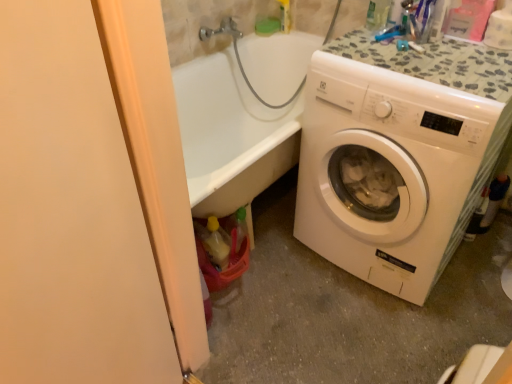
Locate an element on the screen. white plastic washing machine at right is located at coordinates (392, 171).

This screenshot has width=512, height=384. Describe the element at coordinates (392, 171) in the screenshot. I see `white plastic washing machine at right` at that location.

Measure the distance between point (422,304) and camera.

Point (422,304) is 5.37 feet from camera.

In order to face white plastic washing machine at right, should I rotate leftwards or rightwards?

Rotate your view right by about 18.151°.

What is the approximate width of white plastic washing machine at right?

It is 23.18 inches.

The width and height of the screenshot is (512, 384). Describe the element at coordinates (71, 213) in the screenshot. I see `matte peach screen door at left` at that location.

Where is `matte peach screen door at left`? The width and height of the screenshot is (512, 384). matte peach screen door at left is located at coordinates (71, 213).

At what (x,y) coordinates should I click in order to perform the action: click on white plastic washing machine at right. Please return your answer as a coordinate pair (x, y). Image resolution: width=512 pixels, height=384 pixels. Looking at the image, I should click on (392, 171).

Considering the relative positions of matte peach screen door at left and white plastic washing machine at right in the image provided, is matte peach screen door at left to the left of white plastic washing machine at right from the viewer's perspective?

Yes, matte peach screen door at left is to the left of white plastic washing machine at right.

Which object is closer to the camera taking this photo, matte peach screen door at left or white plastic washing machine at right?

matte peach screen door at left is more forward.

Considering the positions of points (42, 359) and (422, 209), is point (42, 359) closer to camera compared to point (422, 209)?

Yes, point (42, 359) is in front of point (422, 209).

From the image's perspective, which object appears higher, matte peach screen door at left or white plastic washing machine at right?

From the image's view, white plastic washing machine at right is above.

From a real-world perspective, is matte peach screen door at left located higher than white plastic washing machine at right?

Yes, from a real-world perspective, matte peach screen door at left is over white plastic washing machine at right

Can you confirm if matte peach screen door at left is wider than white plastic washing machine at right?

In fact, matte peach screen door at left might be narrower than white plastic washing machine at right.

Looking at this image, is matte peach screen door at left taller or shorter than white plastic washing machine at right?

matte peach screen door at left is taller than white plastic washing machine at right.

Considering the sizes of objects matte peach screen door at left and white plastic washing machine at right in the image provided, who is smaller, matte peach screen door at left or white plastic washing machine at right?

matte peach screen door at left is smaller.

Do you think matte peach screen door at left is within white plastic washing machine at right, or outside of it?

matte peach screen door at left exists outside the volume of white plastic washing machine at right.

Would you say matte peach screen door at left is a long distance from white plastic washing machine at right?

No, matte peach screen door at left is not far away from white plastic washing machine at right.

Is matte peach screen door at left facing towards white plastic washing machine at right?

No, matte peach screen door at left is not turned towards white plastic washing machine at right.

Can you tell me how much matte peach screen door at left and white plastic washing machine at right differ in facing direction?

The angle between the facing direction of matte peach screen door at left and the facing direction of white plastic washing machine at right is 112 degrees.

How distant is matte peach screen door at left from white plastic washing machine at right?

The distance of matte peach screen door at left from white plastic washing machine at right is 36.37 inches.

Where is `screen door in front of the white plastic washing machine at right`? Image resolution: width=512 pixels, height=384 pixels. screen door in front of the white plastic washing machine at right is located at coordinates click(71, 213).

Is white plastic washing machine at right at the right side of matte peach screen door at left?

Correct, you'll find white plastic washing machine at right to the right of matte peach screen door at left.

Consider the image. Is the depth of white plastic washing machine at right greater than that of matte peach screen door at left?

Yes, white plastic washing machine at right is further from the camera.

Which is less distant, [498,108] or [62,331]?

Point [498,108] appears to be farther away from the viewer than point [62,331].

From the image's perspective, is white plastic washing machine at right located beneath matte peach screen door at left?

No, from the image's perspective, white plastic washing machine at right is not below matte peach screen door at left.

From a real-world perspective, who is located higher, white plastic washing machine at right or matte peach screen door at left?

In real-world perspective, matte peach screen door at left is above.

In the scene shown: Which of these two, white plastic washing machine at right or matte peach screen door at left, is thinner?

Thinner between the two is matte peach screen door at left.

Considering the relative sizes of white plastic washing machine at right and matte peach screen door at left in the image provided, is white plastic washing machine at right taller than matte peach screen door at left?

No, white plastic washing machine at right is not taller than matte peach screen door at left.

Based on the photo, can you confirm if white plastic washing machine at right is smaller than matte peach screen door at left?

No, white plastic washing machine at right is not smaller than matte peach screen door at left.

Is white plastic washing machine at right not within matte peach screen door at left?

Yes, white plastic washing machine at right is not within matte peach screen door at left.

Is white plastic washing machine at right not near matte peach screen door at left?

white plastic washing machine at right is near matte peach screen door at left, not far away.

Is white plastic washing machine at right oriented towards matte peach screen door at left?

Yes.

In the scene shown: What's the angular difference between white plastic washing machine at right and matte peach screen door at left's facing directions?

112 degrees.

Identify the location of washing machine behind the matte peach screen door at left. (392, 171).

In the image, there is a white plastic washing machine at right. At what (x,y) coordinates should I click in order to perform the action: click on screen door below it (from the image's perspective). Please return your answer as a coordinate pair (x, y). The width and height of the screenshot is (512, 384). Looking at the image, I should click on (71, 213).

In the image, there is a matte peach screen door at left. At what (x,y) coordinates should I click in order to perform the action: click on washing machine above it (from the image's perspective). Please return your answer as a coordinate pair (x, y). Looking at the image, I should click on (392, 171).